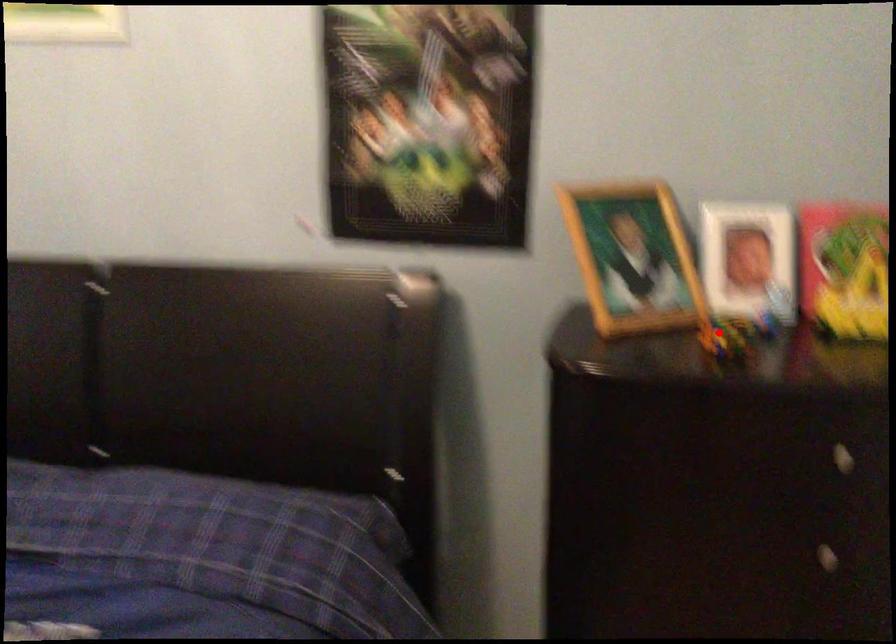
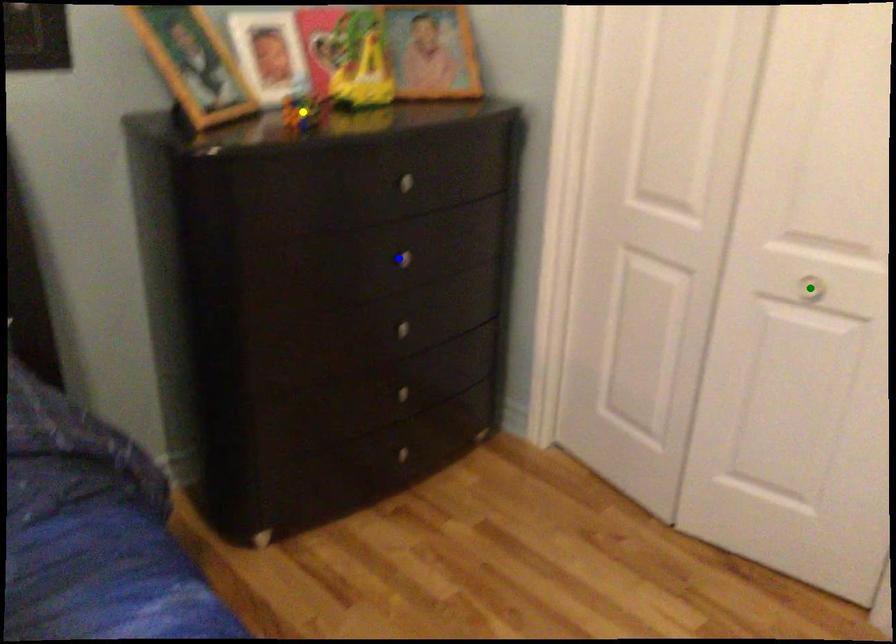
Question: I am providing you with two images of the same scene from different viewpoints. A red point is marked on the first image. You are given multiple points on the second image. Which mark in image 2 goes with the point in image 1?

Choices:
 (A) blue point
 (B) green point
 (C) yellow point

Answer: (C)